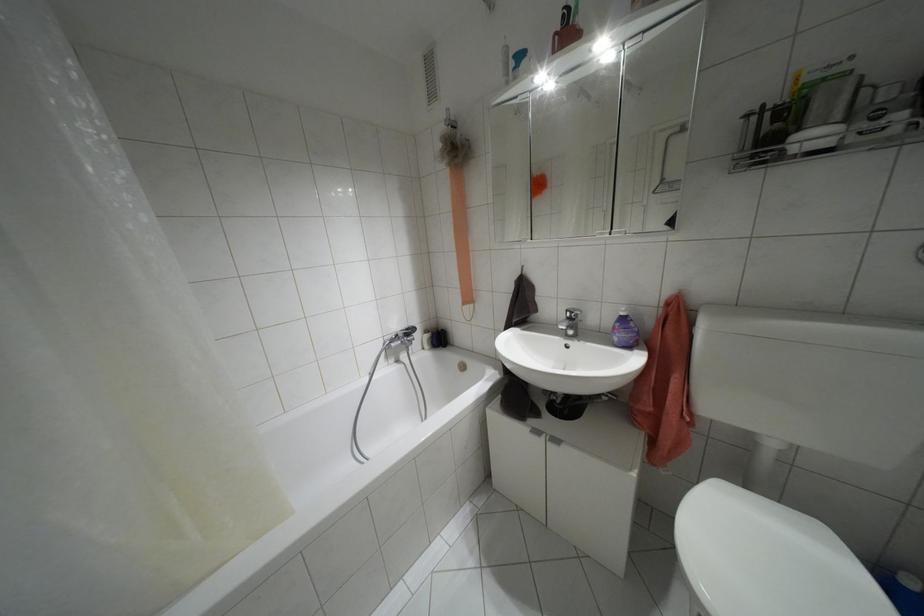
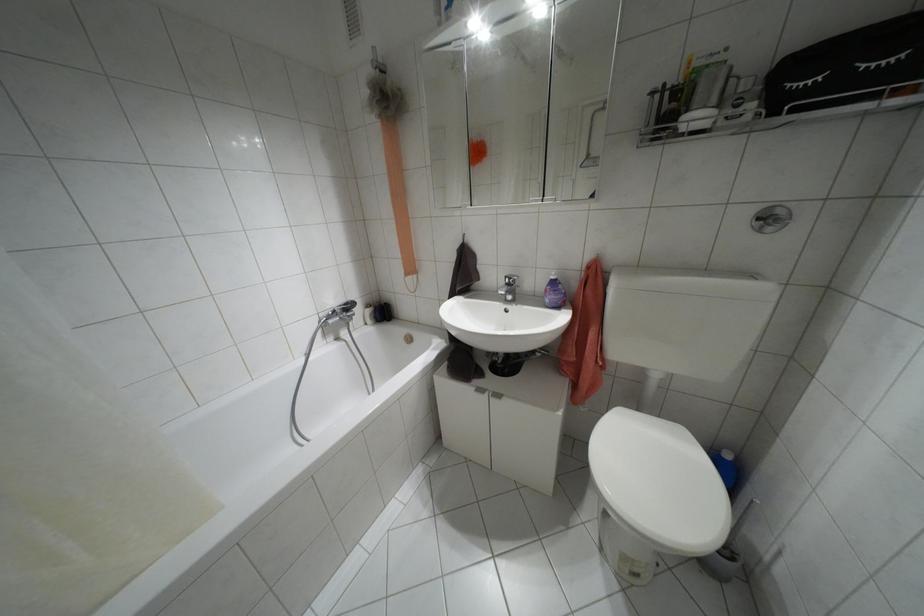
Locate, in the second image, the point that corresponds to (x=622, y=313) in the first image.

(552, 277)